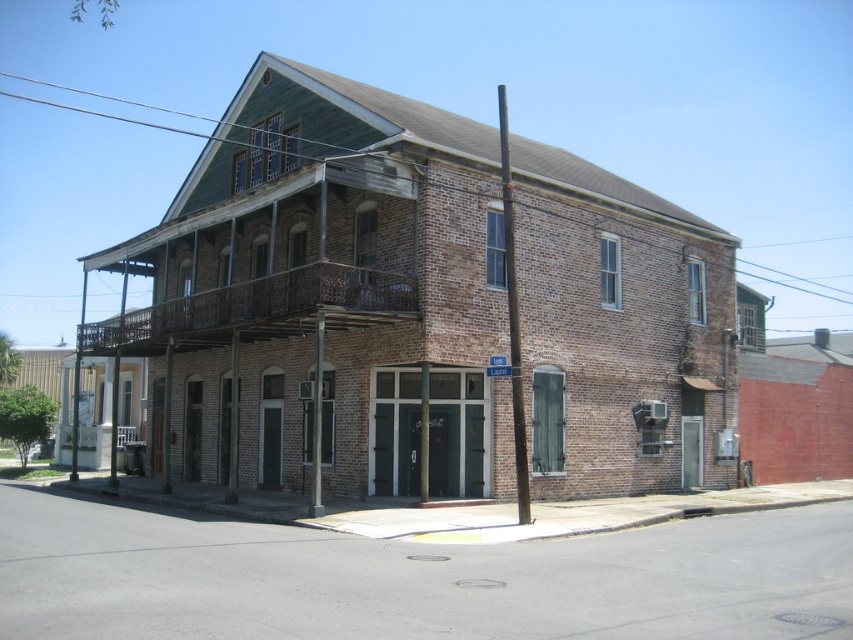
Consider the image. Is smooth gray pole at center behind metallic pole at lower center?

No, smooth gray pole at center is in front of metallic pole at lower center.

Find the location of a particular element. This screenshot has height=640, width=853. smooth gray pole at center is located at coordinates (514, 320).

Measure the distance from brown wrought iron balcony at upper center to brown wooden pole at center.

18.69 feet

Can you confirm if brown wrought iron balcony at upper center is positioned to the left of brown wooden pole at center?

→ Yes, brown wrought iron balcony at upper center is to the left of brown wooden pole at center.

Where is `brown wrought iron balcony at upper center`? The image size is (853, 640). brown wrought iron balcony at upper center is located at coordinates (254, 278).

You are a GUI agent. You are given a task and a screenshot of the screen. Output one action in this format:
    pyautogui.click(x=<x>, y=<y>)
    Task: Click on the brown wrought iron balcony at upper center
    
    Given the screenshot: What is the action you would take?
    pyautogui.click(x=254, y=278)

Between smooth gray pole at center and metallic pole at center, which one appears on the left side from the viewer's perspective?

From the viewer's perspective, metallic pole at center appears more on the left side.

What do you see at coordinates (514, 320) in the screenshot? I see `smooth gray pole at center` at bounding box center [514, 320].

At what (x,y) coordinates should I click in order to perform the action: click on smooth gray pole at center. Please return your answer as a coordinate pair (x, y). Image resolution: width=853 pixels, height=640 pixels. Looking at the image, I should click on (514, 320).